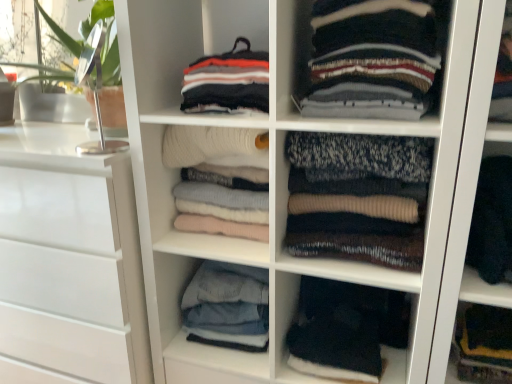
Question: Which direction should I rotate to face soft white sweater at center, which is counted as the second clothing, starting from the left, — up or down?

Choices:
 (A) down
 (B) up

Answer: (B)

Question: From the image's perspective, is striped wool sweater at center, which appears as the 2th clothing when viewed from the right, over white glossy chest of drawers at left?

Choices:
 (A) yes
 (B) no

Answer: (A)

Question: Is striped wool sweater at center, the 5th clothing viewed from the left, oriented towards white glossy chest of drawers at left?

Choices:
 (A) yes
 (B) no

Answer: (B)

Question: Does striped wool sweater at center, which appears as the 2th clothing when viewed from the right, lie behind white glossy chest of drawers at left?

Choices:
 (A) no
 (B) yes

Answer: (A)

Question: Is striped wool sweater at center, the 5th clothing viewed from the left, turned away from white glossy chest of drawers at left?

Choices:
 (A) no
 (B) yes

Answer: (A)

Question: Considering the relative sizes of striped wool sweater at center, the 5th clothing viewed from the left, and white glossy chest of drawers at left in the image provided, is striped wool sweater at center, the 5th clothing viewed from the left, smaller than white glossy chest of drawers at left?

Choices:
 (A) no
 (B) yes

Answer: (B)

Question: Would you consider striped wool sweater at center, the 5th clothing viewed from the left, to be distant from white glossy chest of drawers at left?

Choices:
 (A) yes
 (B) no

Answer: (B)

Question: From a real-world perspective, is denim jeans at center, positioned as the 6th clothing in right-to-left order, physically above dark wool sweater at right, the 6th clothing from the left?

Choices:
 (A) no
 (B) yes

Answer: (A)

Question: Is denim jeans at center, positioned as the 6th clothing in right-to-left order, bigger than dark wool sweater at right, the 6th clothing from the left?

Choices:
 (A) yes
 (B) no

Answer: (A)

Question: Can dark wool sweater at right, the 6th clothing from the left, be found inside denim jeans at center, arranged as the 1th clothing when viewed from the left?

Choices:
 (A) yes
 (B) no

Answer: (B)

Question: Are denim jeans at center, positioned as the 6th clothing in right-to-left order, and dark wool sweater at right, placed as the 1th clothing when sorted from right to left, beside each other?

Choices:
 (A) yes
 (B) no

Answer: (B)

Question: Does denim jeans at center, positioned as the 6th clothing in right-to-left order, come in front of dark wool sweater at right, the 6th clothing from the left?

Choices:
 (A) no
 (B) yes

Answer: (A)

Question: Is denim jeans at center, positioned as the 6th clothing in right-to-left order, not close to dark wool sweater at right, placed as the 1th clothing when sorted from right to left?

Choices:
 (A) no
 (B) yes

Answer: (A)

Question: From a real-world perspective, is dark wool sweater at right, placed as the 1th clothing when sorted from right to left, below denim jeans at center, arranged as the 1th clothing when viewed from the left?

Choices:
 (A) no
 (B) yes

Answer: (A)